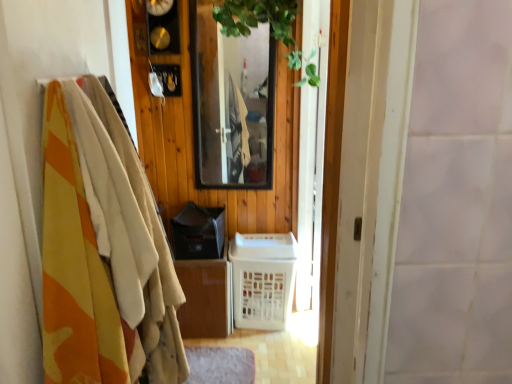
Question: Is gray soft mat at lower center thinner than white plastic basket at center?

Choices:
 (A) no
 (B) yes

Answer: (B)

Question: From the image's perspective, would you say gray soft mat at lower center is positioned over white plastic basket at center?

Choices:
 (A) no
 (B) yes

Answer: (A)

Question: Is gray soft mat at lower center surrounding white plastic basket at center?

Choices:
 (A) no
 (B) yes

Answer: (A)

Question: From a real-world perspective, is gray soft mat at lower center physically above white plastic basket at center?

Choices:
 (A) yes
 (B) no

Answer: (B)

Question: Does gray soft mat at lower center appear on the left side of white plastic basket at center?

Choices:
 (A) no
 (B) yes

Answer: (B)

Question: Is gray soft mat at lower center touching white plastic basket at center?

Choices:
 (A) no
 (B) yes

Answer: (A)

Question: Does white plastic basket at center have a lesser height compared to green leafy plant at upper center?

Choices:
 (A) no
 (B) yes

Answer: (A)

Question: From the image's perspective, is white plastic basket at center above green leafy plant at upper center?

Choices:
 (A) no
 (B) yes

Answer: (A)

Question: Would you say green leafy plant at upper center is part of white plastic basket at center's contents?

Choices:
 (A) yes
 (B) no

Answer: (B)

Question: From a real-world perspective, is white plastic basket at center over green leafy plant at upper center?

Choices:
 (A) no
 (B) yes

Answer: (A)

Question: Is white plastic basket at center at the right side of green leafy plant at upper center?

Choices:
 (A) yes
 (B) no

Answer: (A)

Question: Is white plastic basket at center closer to camera compared to green leafy plant at upper center?

Choices:
 (A) yes
 (B) no

Answer: (B)

Question: Are camouflage fabric blanket at left and green leafy plant at upper center located far from each other?

Choices:
 (A) yes
 (B) no

Answer: (A)